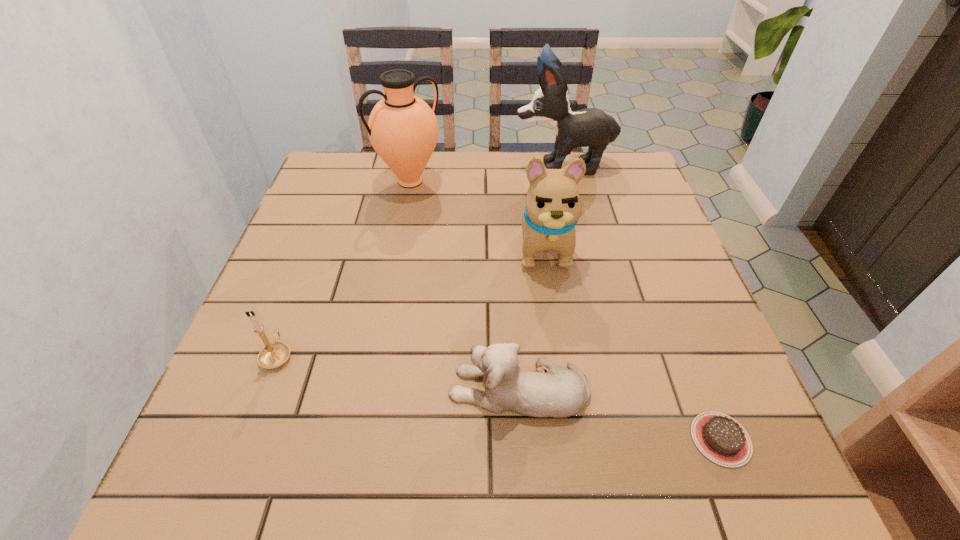
Locate an element on the screen. Image resolution: width=960 pixels, height=540 pixels. vacant space that's between the tallest puppy and the pitcher is located at coordinates point(487,173).

Image resolution: width=960 pixels, height=540 pixels. I want to click on free area in between the tallest puppy and the pitcher, so click(487, 173).

What are the coordinates of `vacant area between the chocolate cake and the second shortest puppy` in the screenshot? It's located at (633, 342).

Identify which object is the third closest to the nearest puppy. Please provide its 2D coordinates. Your answer should be formatted as a tuple, i.e. [(x, y)], where the tuple contains the x and y coordinates of a point satisfying the conditions above.

[(273, 355)]

Locate an element on the screen. object that is the second closest to the shortest object is located at coordinates (553, 206).

Identify which puppy is the nearest to the tallest puppy. Please provide its 2D coordinates. Your answer should be formatted as a tuple, i.e. [(x, y)], where the tuple contains the x and y coordinates of a point satisfying the conditions above.

[(553, 206)]

Find the location of `the second closest puppy relative to the farthest puppy`. the second closest puppy relative to the farthest puppy is located at coordinates (561, 392).

Where is `free location that satisfies the following two spatial constraints: 1. on the face of the fourth nearest object; 2. on the right side of the shortest object`? free location that satisfies the following two spatial constraints: 1. on the face of the fourth nearest object; 2. on the right side of the shortest object is located at coordinates (573, 439).

Identify the location of free space in the image that satisfies the following two spatial constraints: 1. on the front-facing side of the chocolate cake; 2. on the left side of the shortest puppy. (522, 439).

This screenshot has height=540, width=960. I want to click on free space that satisfies the following two spatial constraints: 1. on the handle side of the fifth object from right to left; 2. on the right side of the leftmost object, so click(x=343, y=181).